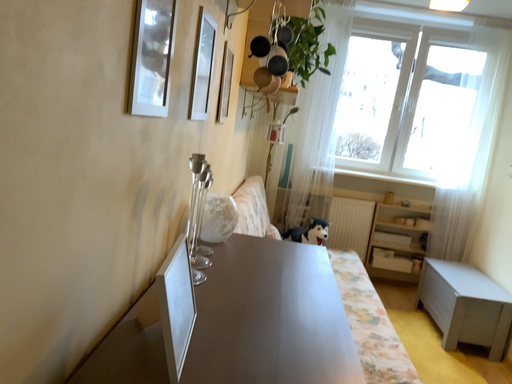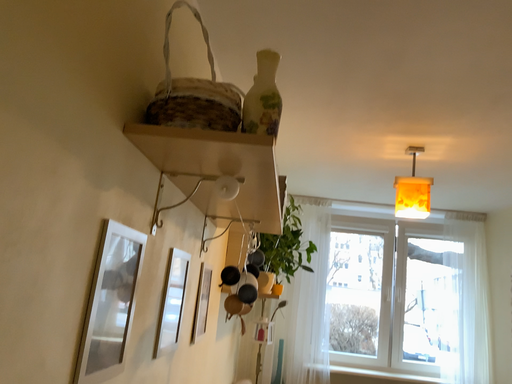
Question: Which way did the camera rotate in the video?

Choices:
 (A) rotated downward
 (B) rotated upward

Answer: (B)